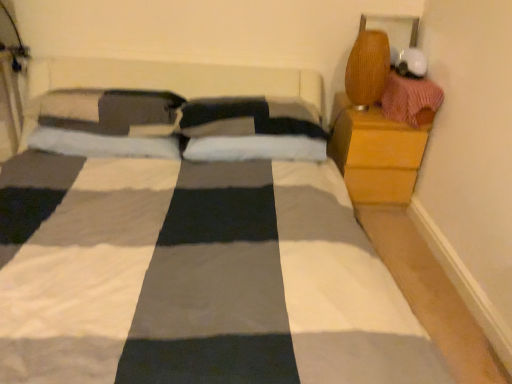
Question: Is wooden nightstand at right looking in the opposite direction of knitted pink sweater at upper right?

Choices:
 (A) yes
 (B) no

Answer: (B)

Question: Is wooden nightstand at right further to camera compared to knitted pink sweater at upper right?

Choices:
 (A) yes
 (B) no

Answer: (A)

Question: Considering the relative positions of wooden nightstand at right and knitted pink sweater at upper right in the image provided, is wooden nightstand at right to the right of knitted pink sweater at upper right from the viewer's perspective?

Choices:
 (A) yes
 (B) no

Answer: (B)

Question: Does wooden nightstand at right touch knitted pink sweater at upper right?

Choices:
 (A) yes
 (B) no

Answer: (B)

Question: Is wooden nightstand at right located outside knitted pink sweater at upper right?

Choices:
 (A) no
 (B) yes

Answer: (B)

Question: Is wooden nightstand at right at the left side of knitted pink sweater at upper right?

Choices:
 (A) yes
 (B) no

Answer: (A)

Question: From the image's perspective, is knitted pink sweater at upper right under wooden nightstand at right?

Choices:
 (A) yes
 (B) no

Answer: (B)

Question: Is knitted pink sweater at upper right not close to wooden nightstand at right?

Choices:
 (A) yes
 (B) no

Answer: (B)

Question: Is knitted pink sweater at upper right located outside wooden nightstand at right?

Choices:
 (A) no
 (B) yes

Answer: (B)

Question: Is knitted pink sweater at upper right at the right side of wooden nightstand at right?

Choices:
 (A) no
 (B) yes

Answer: (B)

Question: Does knitted pink sweater at upper right contain wooden nightstand at right?

Choices:
 (A) no
 (B) yes

Answer: (A)

Question: Is knitted pink sweater at upper right at the left side of wooden nightstand at right?

Choices:
 (A) yes
 (B) no

Answer: (B)

Question: From the image's perspective, relative to knitted pink sweater at upper right, is wooden nightstand at right above or below?

Choices:
 (A) below
 (B) above

Answer: (A)